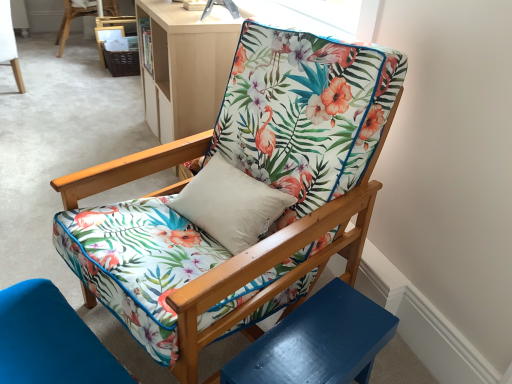
Question: From the image's perspective, is glossy blue side table at lower right located above floral fabric chair at upper center, which is the 2th chair in back-to-front order?

Choices:
 (A) yes
 (B) no

Answer: (B)

Question: Is the depth of glossy blue side table at lower right greater than that of floral fabric chair at upper center, arranged as the second chair when viewed from the top?

Choices:
 (A) no
 (B) yes

Answer: (A)

Question: Can you confirm if glossy blue side table at lower right is taller than floral fabric chair at upper center, the fourth chair when ordered from right to left?

Choices:
 (A) yes
 (B) no

Answer: (B)

Question: Does glossy blue side table at lower right have a greater width compared to floral fabric chair at upper center, the 3th chair from the front?

Choices:
 (A) no
 (B) yes

Answer: (B)

Question: Does glossy blue side table at lower right have a larger size compared to floral fabric chair at upper center, which appears as the 3th chair when ordered from the bottom?

Choices:
 (A) no
 (B) yes

Answer: (A)

Question: Is glossy blue side table at lower right outside floral fabric chair at upper center, which appears as the 3th chair when ordered from the bottom?

Choices:
 (A) yes
 (B) no

Answer: (A)

Question: Does matte wood bookshelf at upper center have a greater height compared to floral fabric chair at upper center, which appears as the 3th chair when ordered from the bottom?

Choices:
 (A) yes
 (B) no

Answer: (A)

Question: Is matte wood bookshelf at upper center further to the viewer compared to floral fabric chair at upper center, the fourth chair when ordered from right to left?

Choices:
 (A) yes
 (B) no

Answer: (B)

Question: Can you confirm if matte wood bookshelf at upper center is thinner than floral fabric chair at upper center, the fourth chair when ordered from right to left?

Choices:
 (A) no
 (B) yes

Answer: (A)

Question: From the image's perspective, does matte wood bookshelf at upper center appear higher than floral fabric chair at upper center, which is the 2th chair in back-to-front order?

Choices:
 (A) no
 (B) yes

Answer: (A)

Question: From a real-world perspective, is matte wood bookshelf at upper center located higher than floral fabric chair at upper center, arranged as the second chair when viewed from the top?

Choices:
 (A) yes
 (B) no

Answer: (A)

Question: Is floral fabric chair at upper center, which is the first chair in left-to-right order, located within matte wood bookshelf at upper center?

Choices:
 (A) no
 (B) yes

Answer: (A)

Question: From a real-world perspective, does floral fabric chair at upper center, the fourth chair when ordered from right to left, sit lower than floral fabric chair at center, the fourth chair from the left?

Choices:
 (A) yes
 (B) no

Answer: (A)